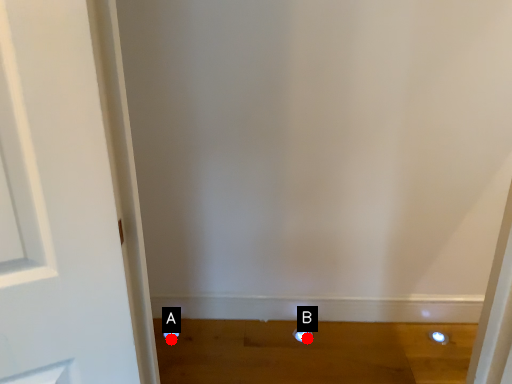
Question: Two points are circled on the image, labeled by A and B beside each circle. Which point is closer to the camera?

Choices:
 (A) A is closer
 (B) B is closer

Answer: (B)